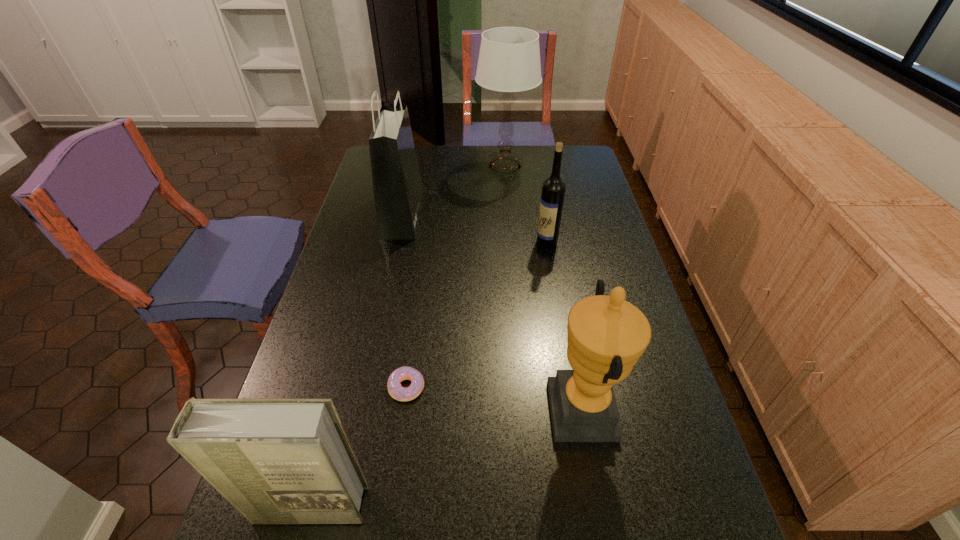
Identify the location of the farthest object. (509, 59).

At what (x,y) coordinates should I click in order to perform the action: click on shopping bag. Please return your answer as a coordinate pair (x, y). The width and height of the screenshot is (960, 540). Looking at the image, I should click on (398, 191).

You are a GUI agent. You are given a task and a screenshot of the screen. Output one action in this format:
    pyautogui.click(x=<x>, y=<y>)
    Task: Click on the award
    The width and height of the screenshot is (960, 540).
    Given the screenshot: What is the action you would take?
    pyautogui.click(x=606, y=335)

Locate an element on the screen. wine bottle is located at coordinates (553, 189).

The image size is (960, 540). I want to click on phonebook, so click(288, 460).

Locate an element on the screen. The height and width of the screenshot is (540, 960). the shortest object is located at coordinates (396, 391).

In order to click on free space located on the front-facing side of the farthest object in this screenshot , I will do `click(398, 166)`.

Where is `free location located 0.090m on the front-facing side of the farthest object`? The image size is (960, 540). free location located 0.090m on the front-facing side of the farthest object is located at coordinates (454, 166).

Where is `free space located 0.110m on the front-facing side of the farthest object`? free space located 0.110m on the front-facing side of the farthest object is located at coordinates 449,166.

The height and width of the screenshot is (540, 960). I want to click on free space located 0.320m on the front with handles of the shopping bag, so click(510, 214).